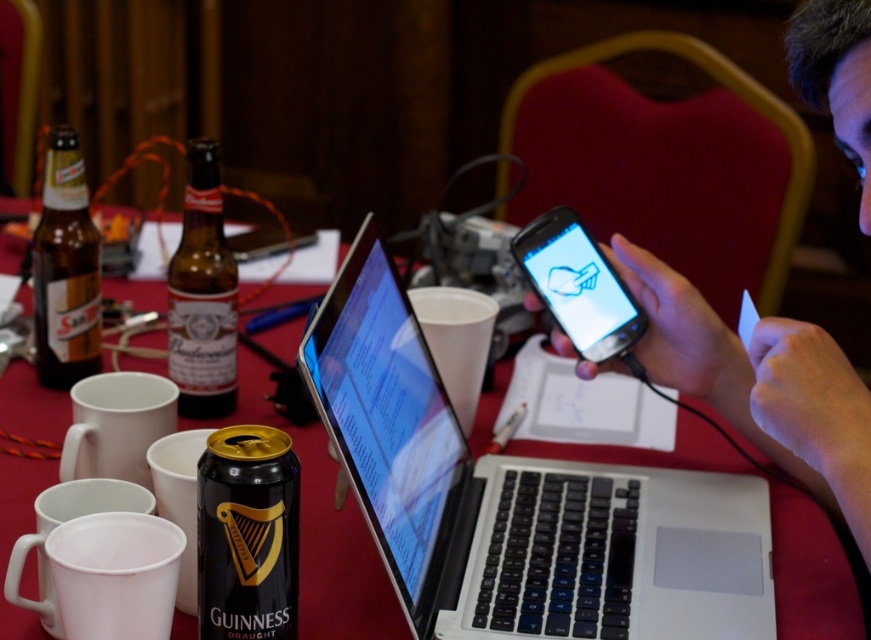
Question: Is black matte can at center-left bigger than amber glass bottle at left?

Choices:
 (A) yes
 (B) no

Answer: (B)

Question: Which object appears closest to the camera in this image?

Choices:
 (A) matte black phone at center
 (B) amber glass bottle at left

Answer: (A)

Question: Observing the image, what is the correct spatial positioning of smooth skin hand at upper right in reference to black matte can at center-left?

Choices:
 (A) right
 (B) left

Answer: (A)

Question: Which object appears closest to the camera in this image?

Choices:
 (A) amber glass bottle at left
 (B) silver/black laptop at center

Answer: (B)

Question: Which of the following is the farthest from the observer?

Choices:
 (A) amber glass bottle at left
 (B) silver/black laptop at center
 (C) matte black phone at center

Answer: (A)

Question: Is the position of silver/black laptop at center more distant than that of black matte can at center-left?

Choices:
 (A) yes
 (B) no

Answer: (B)